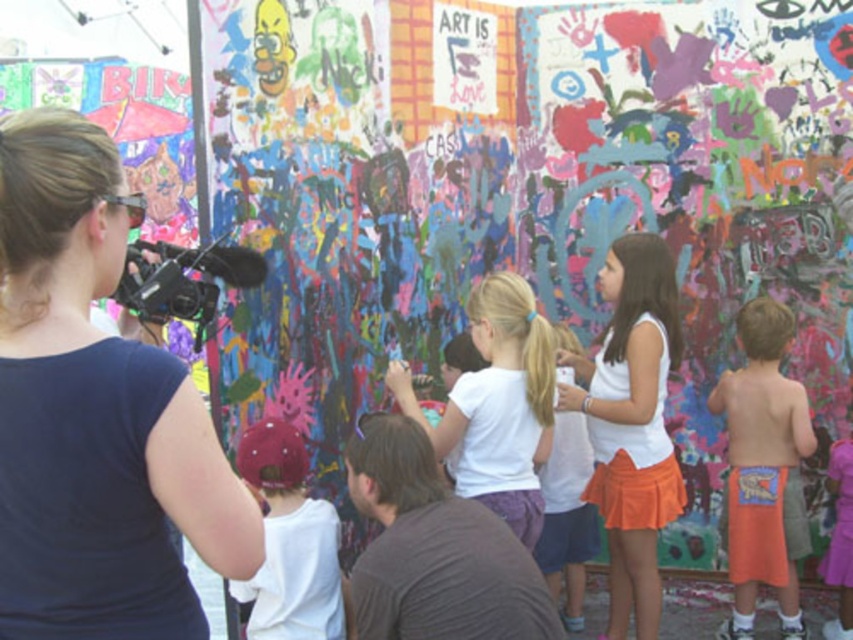
Question: Does orange cotton shorts at right appear on the right side of matte white shirt at lower left?

Choices:
 (A) no
 (B) yes

Answer: (B)

Question: Among these objects, which one is nearest to the camera?

Choices:
 (A) orange cotton shorts at right
 (B) white matte tank top at center

Answer: (A)

Question: Estimate the real-world distances between objects in this image. Which object is closer to the orange cotton shorts at right?

Choices:
 (A) white matte shirt at center
 (B) white matte tank top at center
 (C) matte white shirt at lower left
 (D) dark blue shirt at upper left

Answer: (B)

Question: Is white matte tank top at center above matte white shirt at lower left?

Choices:
 (A) no
 (B) yes

Answer: (B)

Question: Observing the image, what is the correct spatial positioning of orange cotton shorts at right in reference to matte white shirt at lower left?

Choices:
 (A) right
 (B) left

Answer: (A)

Question: Which object is the closest to the dark blue shirt at upper left?

Choices:
 (A) white matte shirt at center
 (B) pink satin dress at lower right
 (C) matte white shirt at lower left

Answer: (C)